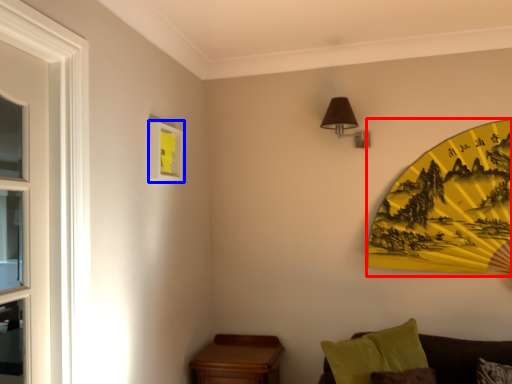
Question: Among these objects, which one is nearest to the camera, design (highlighted by a red box) or picture frame (highlighted by a blue box)?

Choices:
 (A) design
 (B) picture frame

Answer: (B)